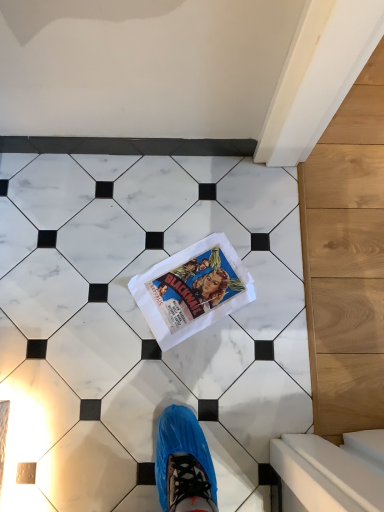
You are a GUI agent. You are given a task and a screenshot of the screen. Output one action in this format:
    pyautogui.click(x=<x>, y=<y>)
    Task: Click on the vacant area that lies in front of white paper comic book at center
    
    Given the screenshot: What is the action you would take?
    pyautogui.click(x=194, y=369)